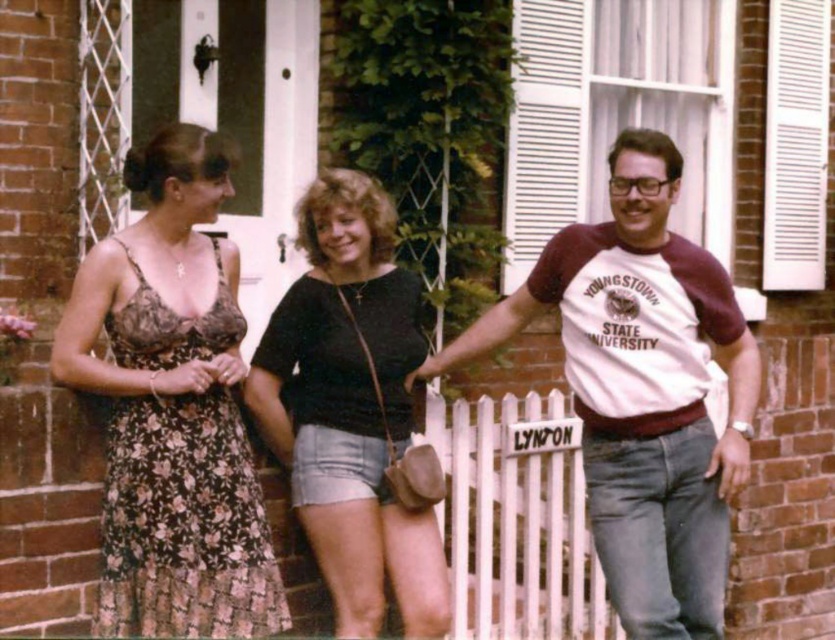
Who is taller, floral dress at left or white cotton t-shirt at center?

white cotton t-shirt at center

Where is `floral dress at left`? The width and height of the screenshot is (835, 640). floral dress at left is located at coordinates (439, 372).

Is point (133, 595) closer to camera compared to point (709, 493)?

Yes, point (133, 595) is closer to viewer.

Can you confirm if floral-patterned dress at left is smaller than white cotton t-shirt at center?

Yes, floral-patterned dress at left is smaller than white cotton t-shirt at center.

Is point (262, 634) farther from camera compared to point (671, 541)?

No, (262, 634) is closer to viewer.

Locate an element on the screen. This screenshot has height=640, width=835. floral-patterned dress at left is located at coordinates (171, 406).

Between point (731, 464) and point (383, 454), which one is positioned behind?

Point (383, 454)

This screenshot has width=835, height=640. I want to click on white cotton t-shirt at center, so click(x=641, y=390).

This screenshot has width=835, height=640. I want to click on white cotton t-shirt at center, so click(641, 390).